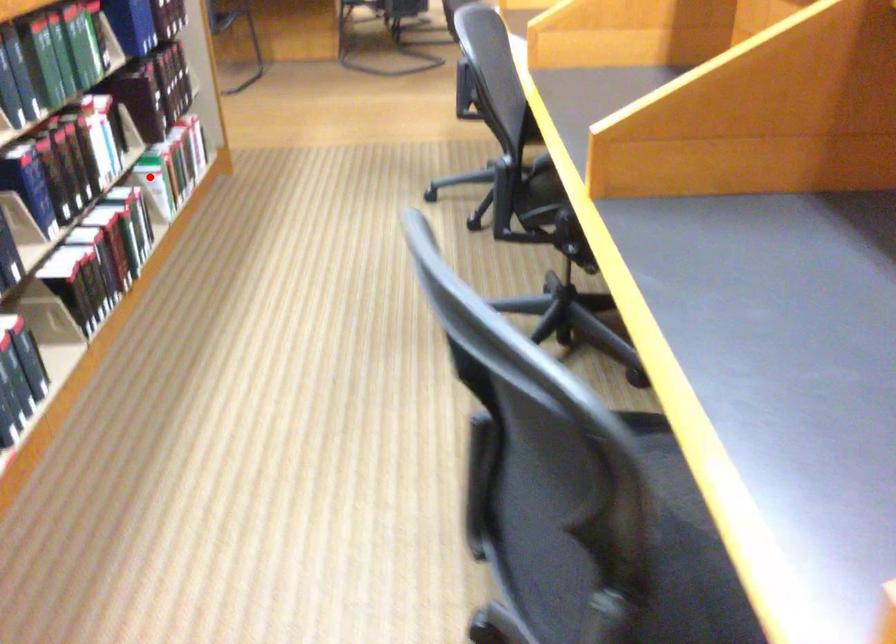
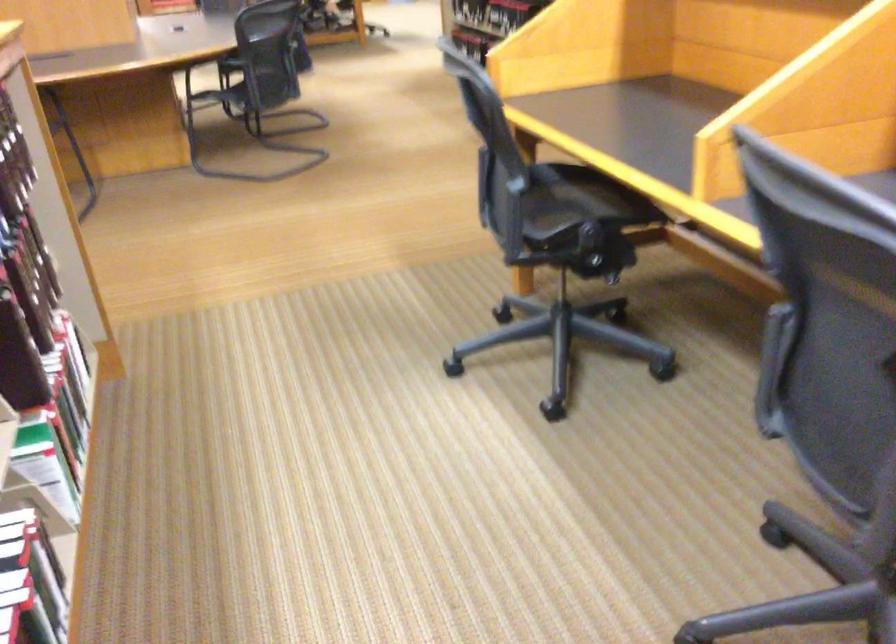
The point at the highlighted location is marked in the first image. Where is the corresponding point in the second image?

(37, 466)